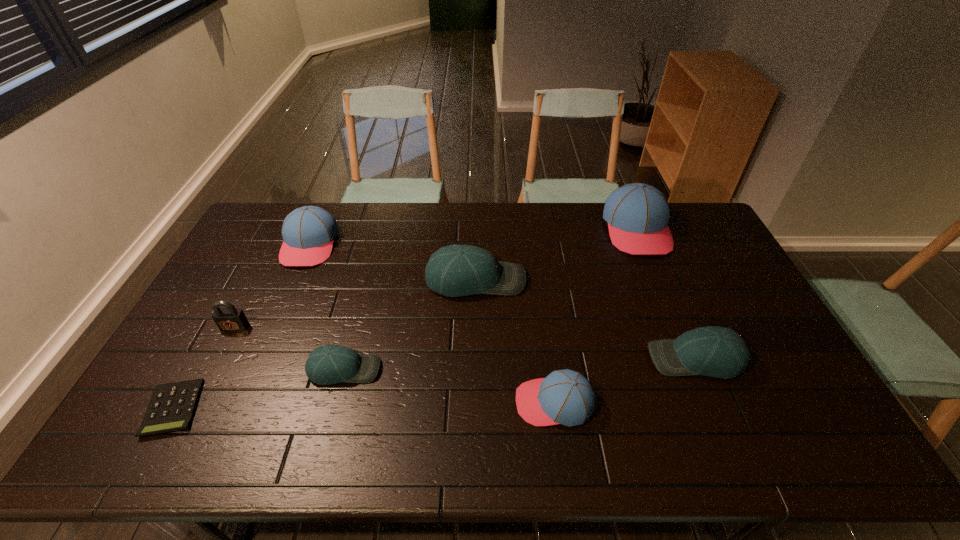
This screenshot has width=960, height=540. Identify the location of baseball cap that stands as the fifth closest to the biggest blue baseball cap. 308,232.

Where is `blue baseball cap object that ranks as the second closest to the second baseball cap from left to right`? blue baseball cap object that ranks as the second closest to the second baseball cap from left to right is located at coordinates (566, 397).

Find the location of `blue baseball cap identified as the third closest to the padlock`. blue baseball cap identified as the third closest to the padlock is located at coordinates (638, 214).

Point out which light baseball cap is positioned as the second nearest to the rightmost blue baseball cap. Please provide its 2D coordinates. Your answer should be formatted as a tuple, i.e. [(x, y)], where the tuple contains the x and y coordinates of a point satisfying the conditions above.

[(714, 351)]

Select which light baseball cap is the second closest to the second biggest light baseball cap. Please provide its 2D coordinates. Your answer should be formatted as a tuple, i.e. [(x, y)], where the tuple contains the x and y coordinates of a point satisfying the conditions above.

[(330, 364)]

The height and width of the screenshot is (540, 960). I want to click on free point that satisfies the following two spatial constraints: 1. on the front-facing side of the second biggest light baseball cap; 2. on the right side of the second smallest blue baseball cap, so click(260, 359).

At what (x,y) coordinates should I click in order to perform the action: click on vacant space that satisfies the following two spatial constraints: 1. on the front of the gray padlock near the keyhole; 2. on the right side of the second baseball cap from left to right. Please return your answer as a coordinate pair (x, y). Looking at the image, I should click on (213, 369).

You are a GUI agent. You are given a task and a screenshot of the screen. Output one action in this format:
    pyautogui.click(x=<x>, y=<y>)
    Task: Click on the free space in the image that satisfies the following two spatial constraints: 1. on the front-facing side of the second biggest blue baseball cap; 2. on the right side of the second biggest light baseball cap
    
    Given the screenshot: What is the action you would take?
    pyautogui.click(x=260, y=359)

Find the location of a particular element. The height and width of the screenshot is (540, 960). free space that satisfies the following two spatial constraints: 1. on the front-facing side of the leftmost blue baseball cap; 2. on the right side of the smallest light baseball cap is located at coordinates (255, 369).